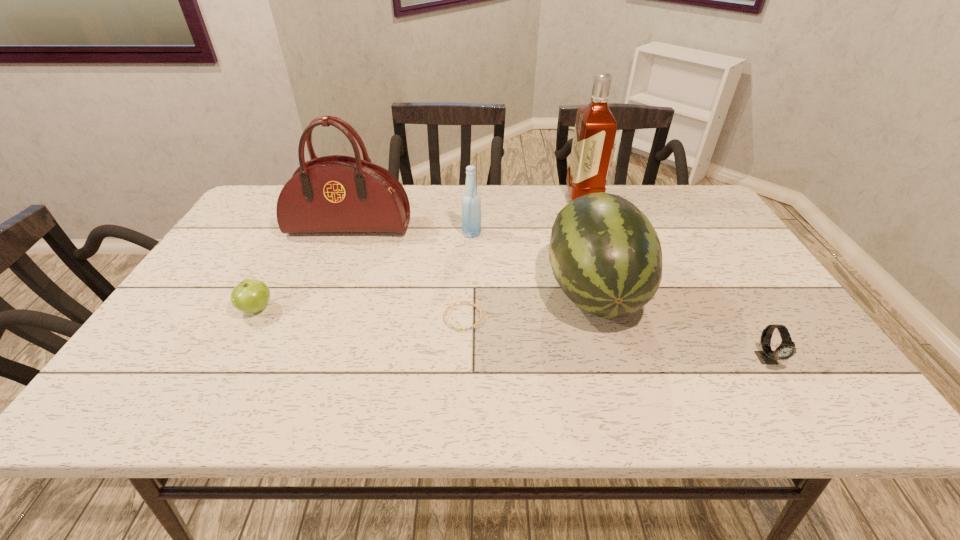
Where is `the farthest object`? The image size is (960, 540). the farthest object is located at coordinates (595, 130).

Image resolution: width=960 pixels, height=540 pixels. Find the location of `handbag`. handbag is located at coordinates (331, 194).

Identify the location of watermelon. Image resolution: width=960 pixels, height=540 pixels. (605, 254).

Identify the location of bottle. (471, 202).

Identify the location of apple. The width and height of the screenshot is (960, 540). [x=250, y=296].

I want to click on the nearest object, so click(786, 349).

This screenshot has height=540, width=960. Find the location of `watch`. watch is located at coordinates (786, 349).

Where is `bracelet`? bracelet is located at coordinates (456, 328).

This screenshot has width=960, height=540. Identify the location of vacant space situated 0.090m on the front label of the liquor. (540, 199).

At what (x,y) coordinates should I click in order to perform the action: click on free spot located 0.080m on the front label of the liquor. Please return your answer as a coordinate pair (x, y). The width and height of the screenshot is (960, 540). Looking at the image, I should click on (543, 199).